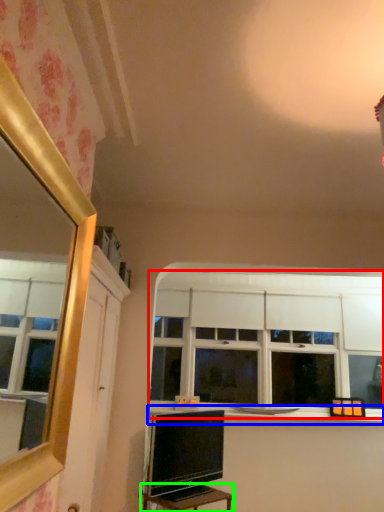
Question: Which object is the farthest from window (highlighted by a red box)? Choose among these: window sill (highlighted by a blue box) or table (highlighted by a green box).

Choices:
 (A) window sill
 (B) table

Answer: (B)